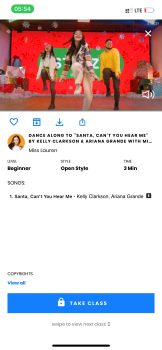
In order to click on red wall in this screenshot , I will do `click(25, 44)`.